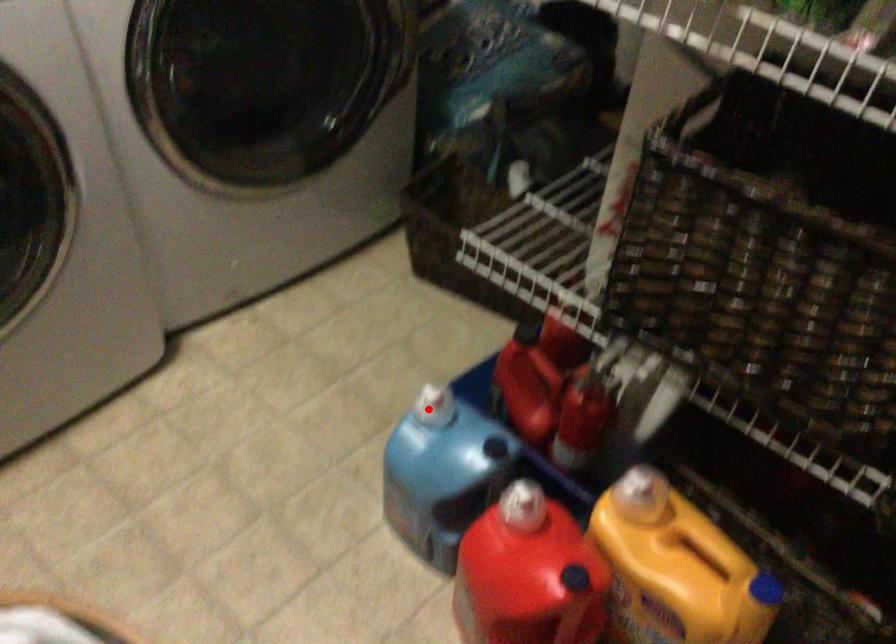
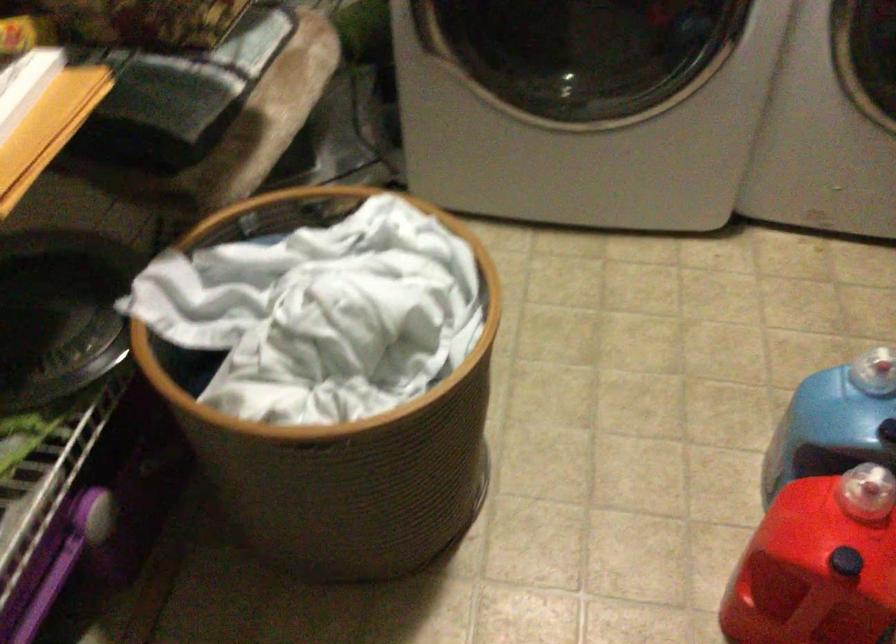
Locate, in the second image, the point that corresponds to the highlighted location in the first image.

(872, 373)